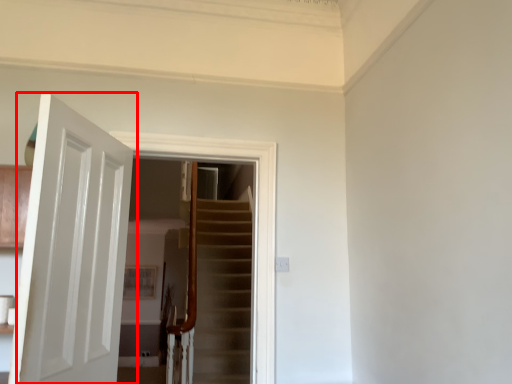
Question: From the image's perspective, considering the relative positions of door (annotated by the red box) and screen door in the image provided, where is door (annotated by the red box) located with respect to the staircase?

Choices:
 (A) below
 (B) above

Answer: (A)